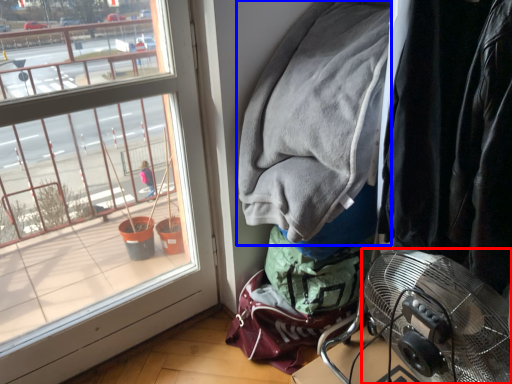
Question: Which object is closer to the camera taking this photo, mechanical fan (highlighted by a red box) or jacket (highlighted by a blue box)?

Choices:
 (A) mechanical fan
 (B) jacket

Answer: (A)